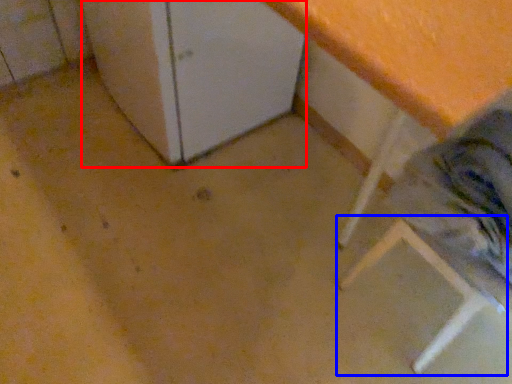
Question: Which point is further to the camera, leftover (highlighted by a red box) or step stool (highlighted by a blue box)?

Choices:
 (A) leftover
 (B) step stool

Answer: (A)